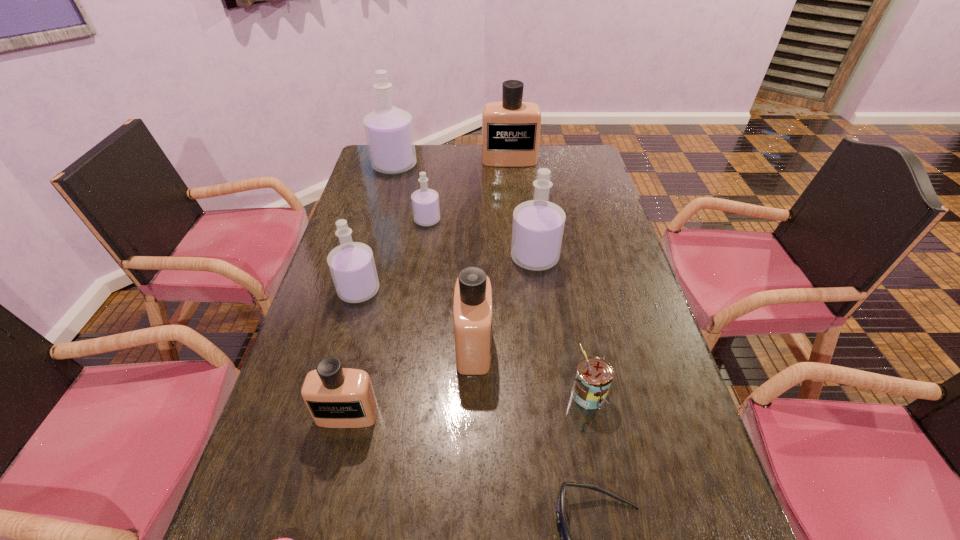
This screenshot has width=960, height=540. In order to click on the third farthest perfume in this screenshot , I will do `click(425, 202)`.

The width and height of the screenshot is (960, 540). In order to click on the nearest perfume in this screenshot , I will do `click(336, 397)`.

Identify the location of the leftmost beige perfume. (336, 397).

This screenshot has height=540, width=960. I want to click on can, so click(594, 375).

Locate an element on the screen. The width and height of the screenshot is (960, 540). vacant region located on the front of the biggest purple perfume is located at coordinates (376, 232).

This screenshot has height=540, width=960. Find the location of `free space located 0.050m on the front label of the farthest beige perfume`. free space located 0.050m on the front label of the farthest beige perfume is located at coordinates (511, 174).

Find the location of a particular element. The width and height of the screenshot is (960, 540). vacant space situated 0.210m on the left of the third farthest purple perfume is located at coordinates (442, 258).

Where is `vacant space located 0.300m on the back of the second smallest purple perfume`? vacant space located 0.300m on the back of the second smallest purple perfume is located at coordinates (380, 215).

This screenshot has height=540, width=960. In order to click on free space located on the front label of the second nearest perfume in this screenshot , I will do `click(636, 346)`.

Locate an element on the screen. The height and width of the screenshot is (540, 960). free space located 0.210m on the back of the fourth perfume from right to left is located at coordinates (433, 179).